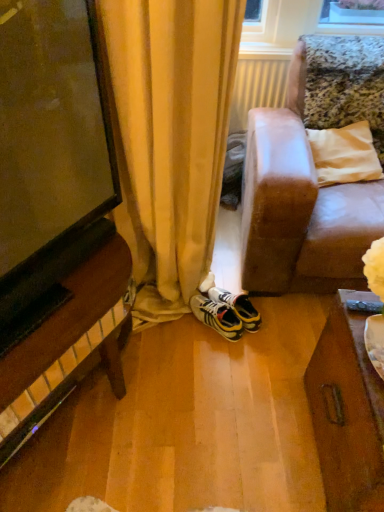
Describe the element at coordinates (257, 86) in the screenshot. I see `white plastic radiator at center` at that location.

This screenshot has width=384, height=512. What are the coordinates of `white plastic radiator at center` in the screenshot? It's located at (257, 86).

Image resolution: width=384 pixels, height=512 pixels. What do you see at coordinates (225, 312) in the screenshot?
I see `yellow and black sneakers at center` at bounding box center [225, 312].

Image resolution: width=384 pixels, height=512 pixels. I want to click on yellow and black sneakers at center, so click(225, 312).

Locate an element on the screen. The width and height of the screenshot is (384, 512). white plastic radiator at center is located at coordinates (257, 86).

Visually, is yellow and black sneakers at center positioned to the left or to the right of white plastic radiator at center?

From the image, it's evident that yellow and black sneakers at center is to the left of white plastic radiator at center.

Is the position of yellow and black sneakers at center less distant than that of white plastic radiator at center?

That is True.

Does point (194, 300) come farther from viewer compared to point (251, 82)?

No, (194, 300) is closer to viewer.

From the image's perspective, is yellow and black sneakers at center located above white plastic radiator at center?

No, from the image's perspective, yellow and black sneakers at center is not over white plastic radiator at center.

From a real-world perspective, is yellow and black sneakers at center on white plastic radiator at center?

No.

Consider the image. Looking at their sizes, would you say yellow and black sneakers at center is wider or thinner than white plastic radiator at center?

Clearly, yellow and black sneakers at center has more width compared to white plastic radiator at center.

Is yellow and black sneakers at center taller or shorter than white plastic radiator at center?

In the image, yellow and black sneakers at center appears to be shorter than white plastic radiator at center.

Considering the sizes of yellow and black sneakers at center and white plastic radiator at center in the image, is yellow and black sneakers at center bigger or smaller than white plastic radiator at center?

Clearly, yellow and black sneakers at center is smaller in size than white plastic radiator at center.

Is yellow and black sneakers at center outside of white plastic radiator at center?

Indeed, yellow and black sneakers at center is completely outside white plastic radiator at center.

Is yellow and black sneakers at center not close to white plastic radiator at center?

That's right, there is a large distance between yellow and black sneakers at center and white plastic radiator at center.

Is yellow and black sneakers at center oriented towards white plastic radiator at center?

No, yellow and black sneakers at center does not turn towards white plastic radiator at center.

How many degrees apart are the facing directions of yellow and black sneakers at center and white plastic radiator at center?

The angle between the facing direction of yellow and black sneakers at center and the facing direction of white plastic radiator at center is 41.6 degrees.

What are the coordinates of `footwear in front of the white plastic radiator at center` in the screenshot? It's located at (225, 312).

Visually, is white plastic radiator at center positioned to the left or to the right of yellow and black sneakers at center?

white plastic radiator at center is to the right of yellow and black sneakers at center.

Between white plastic radiator at center and yellow and black sneakers at center, which one is positioned in front?

yellow and black sneakers at center is more forward.

Considering the points (275, 94) and (210, 302), which point is behind, point (275, 94) or point (210, 302)?

The point (275, 94) is farther from the camera.

From the image's perspective, between white plastic radiator at center and yellow and black sneakers at center, who is located below?

yellow and black sneakers at center is shown below in the image.

From a real-world perspective, between white plastic radiator at center and yellow and black sneakers at center, who is vertically lower?

In real-world perspective, yellow and black sneakers at center is lower.

Is white plastic radiator at center wider or thinner than yellow and black sneakers at center?

Clearly, white plastic radiator at center has less width compared to yellow and black sneakers at center.

Is white plastic radiator at center taller or shorter than yellow and black sneakers at center?

In the image, white plastic radiator at center appears to be taller than yellow and black sneakers at center.

Which of these two, white plastic radiator at center or yellow and black sneakers at center, is bigger?

With larger size is white plastic radiator at center.

Would you say yellow and black sneakers at center is part of white plastic radiator at center's contents?

Actually, yellow and black sneakers at center is outside white plastic radiator at center.

Is white plastic radiator at center positioned far away from yellow and black sneakers at center?

Indeed, white plastic radiator at center is not near yellow and black sneakers at center.

Is white plastic radiator at center facing away from yellow and black sneakers at center?

No, yellow and black sneakers at center is not at the back of white plastic radiator at center.

How much distance is there between white plastic radiator at center and yellow and black sneakers at center?

white plastic radiator at center is 1.12 meters from yellow and black sneakers at center.

Locate an element on the screen. The height and width of the screenshot is (512, 384). footwear below the white plastic radiator at center (from a real-world perspective) is located at coordinates (225, 312).

This screenshot has width=384, height=512. Find the location of `footwear on the left side of white plastic radiator at center`. footwear on the left side of white plastic radiator at center is located at coordinates (225, 312).

This screenshot has height=512, width=384. Find the location of `footwear below the white plastic radiator at center (from a real-world perspective)`. footwear below the white plastic radiator at center (from a real-world perspective) is located at coordinates (225, 312).